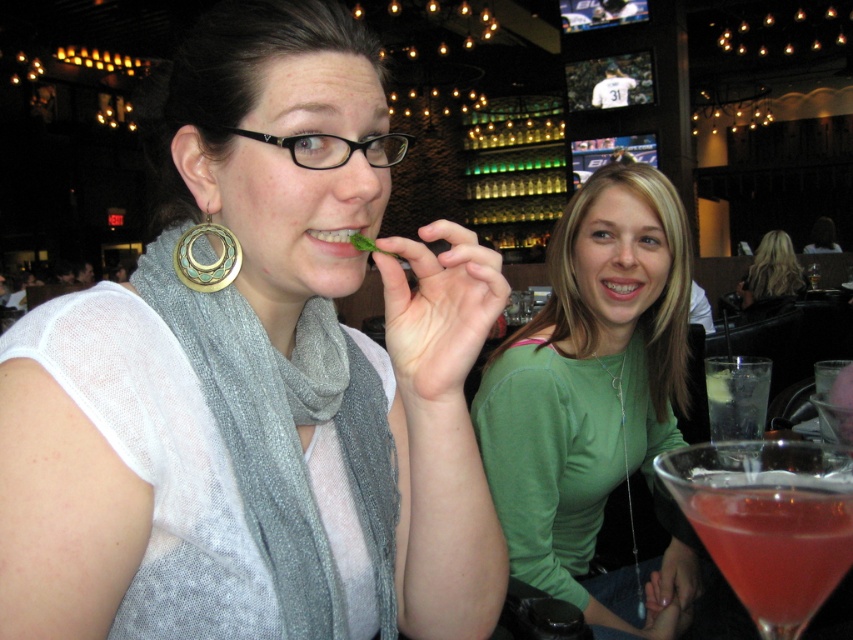
Question: Which object appears farthest from the camera in this image?

Choices:
 (A) black plastic glasses at upper center
 (B) blonde hair at upper center
 (C) green matte shirt at center
 (D) green leafy vegetable at mouth

Answer: (B)

Question: Which object is positioned farthest from the green matte shirt at center?

Choices:
 (A) gray knitted scarf at center
 (B) pink translucent cocktail at lower right

Answer: (B)

Question: Which object is farther from the camera taking this photo?

Choices:
 (A) matte silver scarf at center
 (B) gray knitted scarf at center

Answer: (B)

Question: Where is black plastic glasses at upper center located in relation to blonde hair at upper center in the image?

Choices:
 (A) left
 (B) right

Answer: (A)

Question: Is gray knitted scarf at center in front of blonde hair at upper center?

Choices:
 (A) yes
 (B) no

Answer: (A)

Question: Observing the image, what is the correct spatial positioning of matte silver scarf at center in reference to green matte shirt at center?

Choices:
 (A) below
 (B) above

Answer: (B)